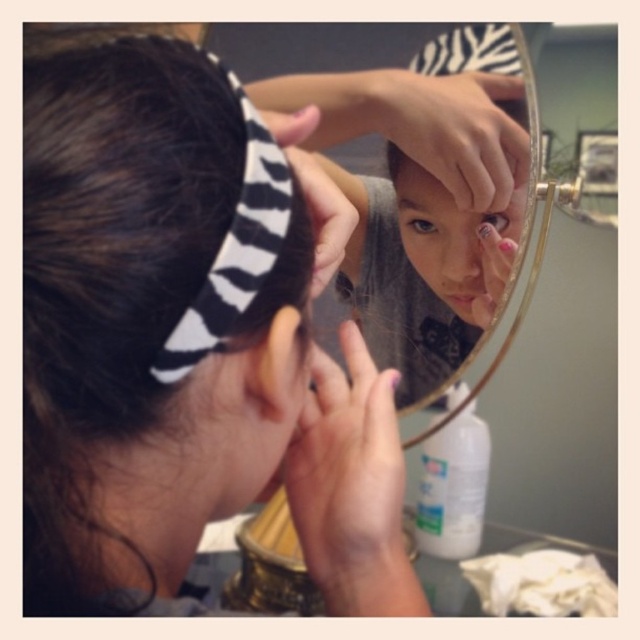
Question: Which point is closer to the camera?

Choices:
 (A) (483, 320)
 (B) (232, 100)

Answer: (B)

Question: Does black and white striped hair band at upper left have a greater width compared to zebra-patterned headband at center?

Choices:
 (A) no
 (B) yes

Answer: (A)

Question: Does black and white striped hair band at upper left have a lesser width compared to zebra-patterned headband at center?

Choices:
 (A) yes
 (B) no

Answer: (A)

Question: Which of the following is the farthest from the observer?

Choices:
 (A) (397, 289)
 (B) (54, 168)

Answer: (A)

Question: Is black and white striped hair band at upper left closer to the viewer compared to zebra-patterned headband at center?

Choices:
 (A) yes
 (B) no

Answer: (A)